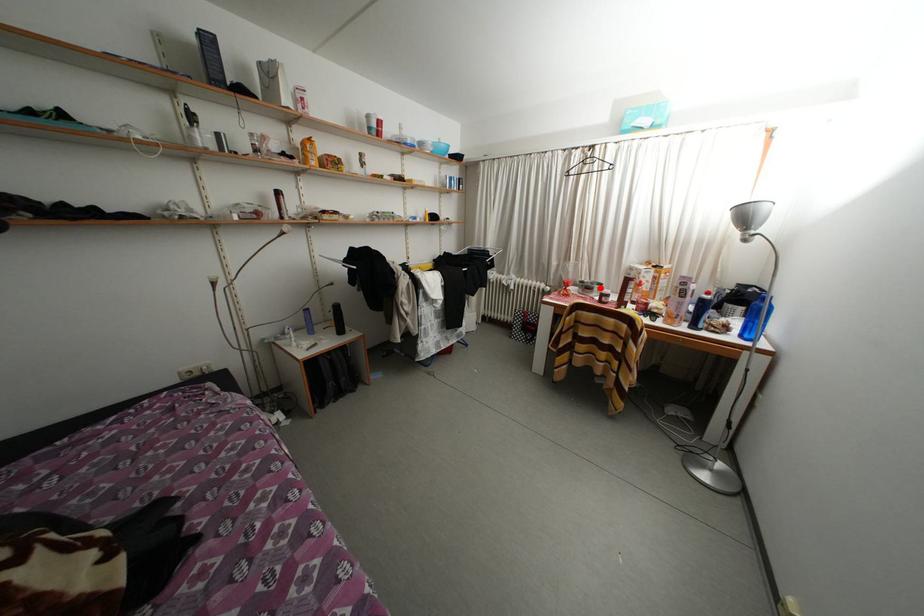
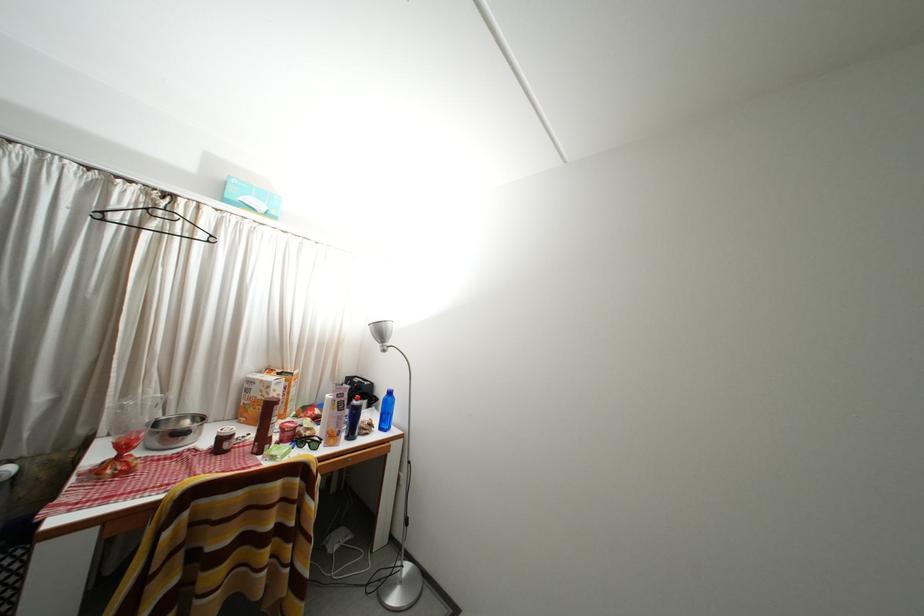
Question: I am providing you with two images of the same scene from different viewpoints. A red point is marked on the first image. Is the red point's position out of view in image 2?

Choices:
 (A) Yes
 (B) No

Answer: (B)